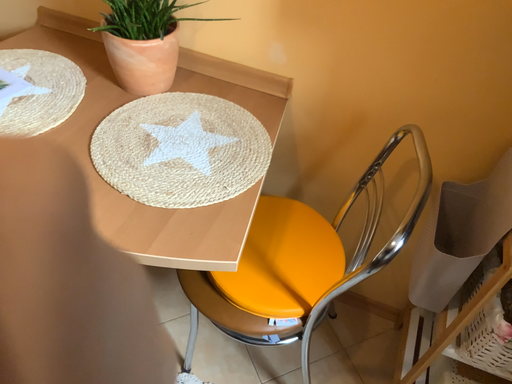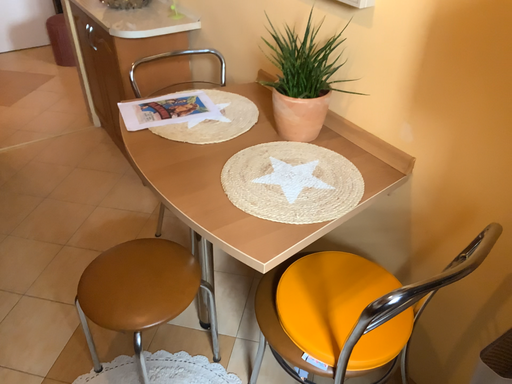
Question: How did the camera likely rotate when shooting the video?

Choices:
 (A) rotated downward
 (B) rotated upward

Answer: (B)